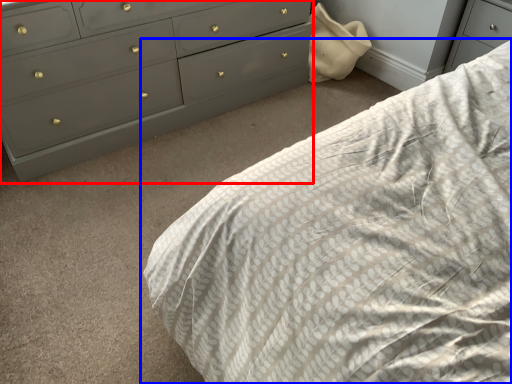
Question: Which object appears closest to the camera in this image, chest of drawers (highlighted by a red box) or bed (highlighted by a blue box)?

Choices:
 (A) chest of drawers
 (B) bed

Answer: (B)